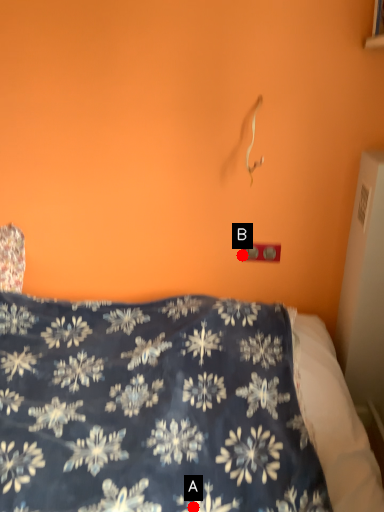
Question: Two points are circled on the image, labeled by A and B beside each circle. Which point appears closest to the camera in this image?

Choices:
 (A) A is closer
 (B) B is closer

Answer: (A)